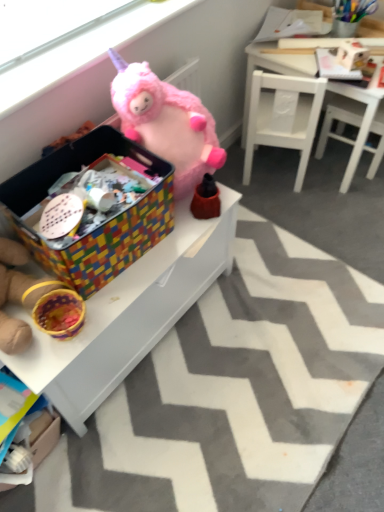
Find the location of a particular element. free space on the front side of brown matte toy at center, which is the second toy in bottom-to-top order is located at coordinates (182, 243).